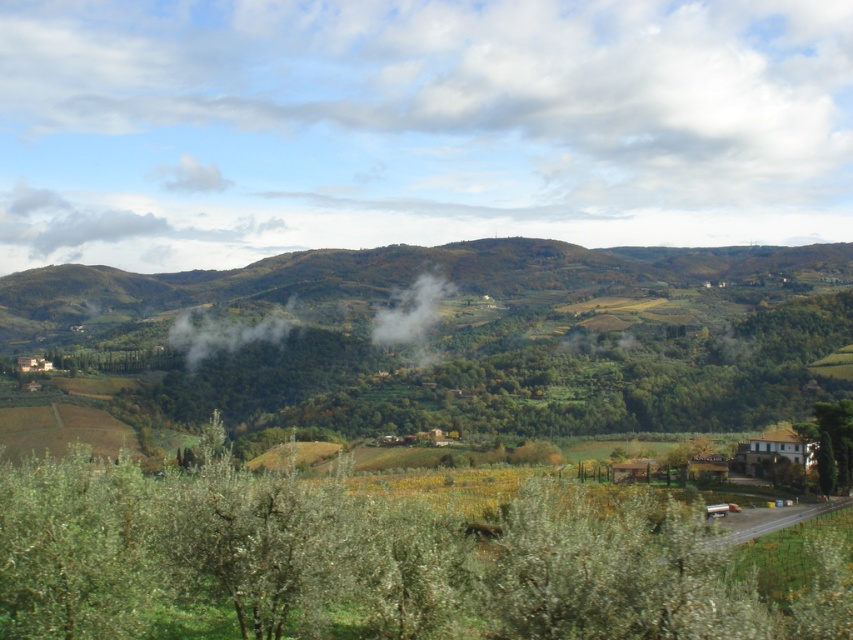
You are a landscape photographer planning to capture the entire green leafy forest at center and green leafy tree at lower right in one frame. Given that your camera has a fixed wide angle lens, which object would require you to adjust your position to ensure both are fully visible?

The green leafy forest at center is wider than the green leafy tree at lower right. To capture both in one frame, you would need to move further back to accommodate the wider width of the green leafy forest at center.

You are standing at the center of the image and want to locate the green leafy tree at lower left. According to the coordinates provided, in which direction should you look to find it?

The green leafy tree at lower left is located at coordinates point (366, 561), so you should look to the lower left direction to find it.